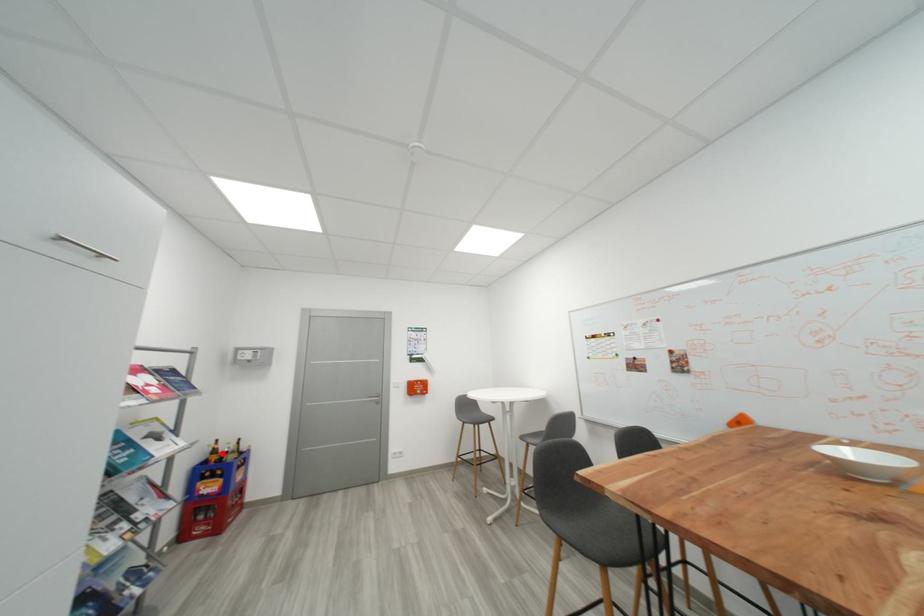
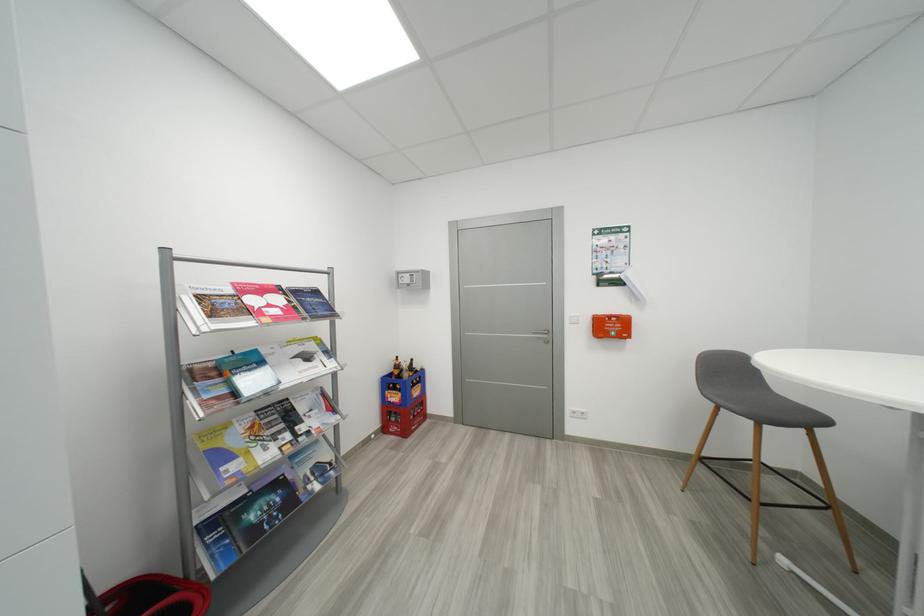
Locate, in the second image, the point that corresponds to the highlighted location in the first image.

(404, 369)